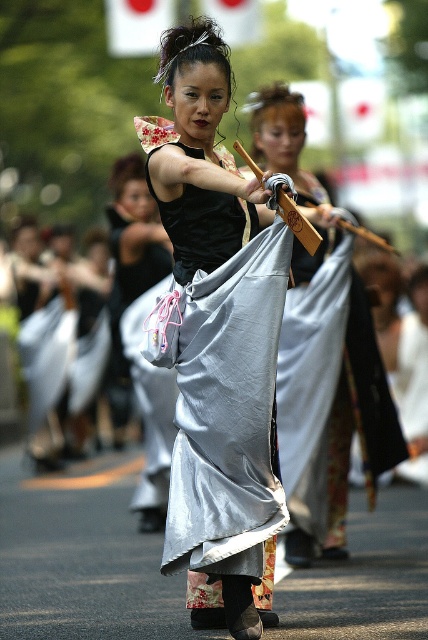
Question: Is satin silver kimono at center smaller than silvery satin kimono at center?

Choices:
 (A) no
 (B) yes

Answer: (A)

Question: Is silvery satin kimono at center to the right of silvery fabric skirt at center from the viewer's perspective?

Choices:
 (A) yes
 (B) no

Answer: (A)

Question: Which is farther from the satin silver kimono at center?

Choices:
 (A) silvery fabric skirt at center
 (B) silvery satin kimono at center

Answer: (A)

Question: Which object is the closest to the satin silver kimono at center?

Choices:
 (A) silvery fabric skirt at center
 (B) silvery satin kimono at center

Answer: (B)

Question: Which of the following is the farthest from the observer?

Choices:
 (A) (139, 499)
 (B) (288, 154)

Answer: (A)

Question: Is satin silver kimono at center closer to camera compared to silvery fabric skirt at center?

Choices:
 (A) no
 (B) yes

Answer: (B)